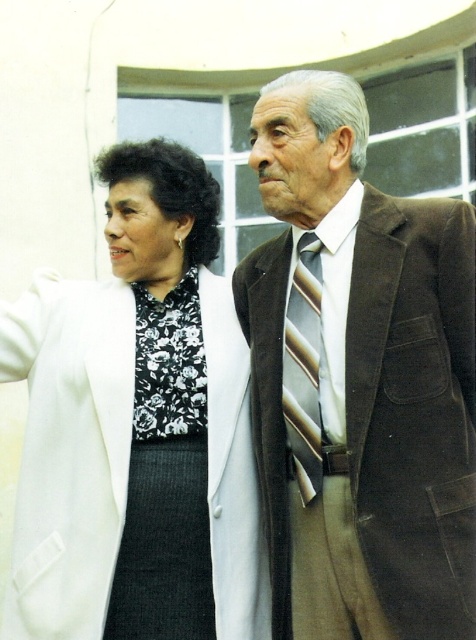
Which is in front, point (165, 316) or point (319, 304)?

Point (319, 304) is in front.

Between point (151, 573) and point (295, 298), which one is positioned in front?

Point (295, 298) is more forward.

I want to click on black floral fabric dress at center, so click(166, 477).

Does suede brown suit at right have a lesser height compared to white textured coat at center?

Incorrect, suede brown suit at right's height does not fall short of white textured coat at center's.

Can you confirm if suede brown suit at right is bigger than white textured coat at center?

Yes, suede brown suit at right is bigger than white textured coat at center.

Describe the element at coordinates (358, 380) in the screenshot. I see `suede brown suit at right` at that location.

What are the coordinates of `suede brown suit at right` in the screenshot? It's located at click(x=358, y=380).

Between point (290, 346) and point (189, 595), which one is positioned in front?

Positioned in front is point (290, 346).

Is suede brown suit at right below black floral fabric dress at center?

Incorrect, suede brown suit at right is not positioned below black floral fabric dress at center.

This screenshot has height=640, width=476. What do you see at coordinates (358, 380) in the screenshot?
I see `suede brown suit at right` at bounding box center [358, 380].

This screenshot has width=476, height=640. Find the location of `suede brown suit at right`. suede brown suit at right is located at coordinates (358, 380).